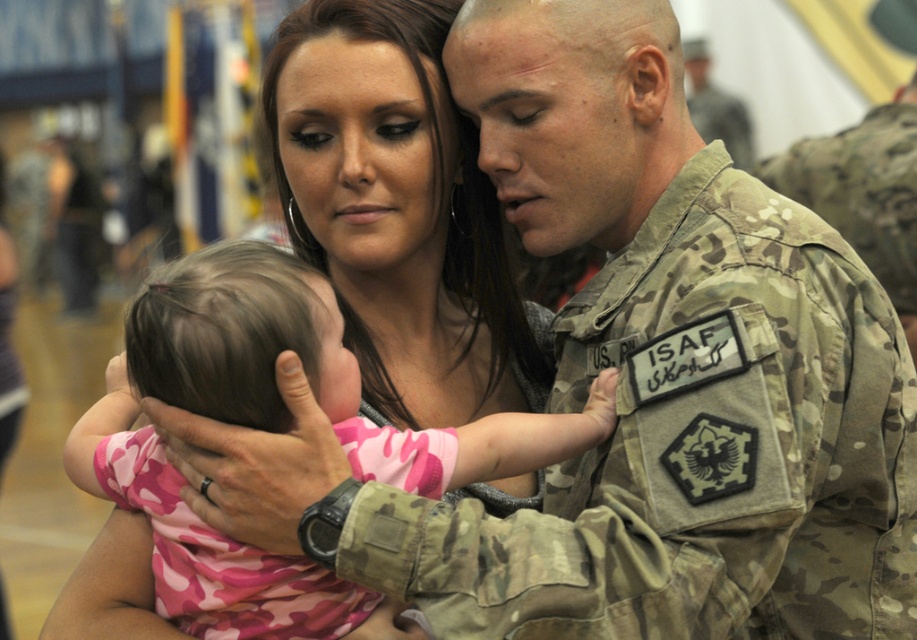
What is the spatial relationship between the camouflage fabric uniform at center and the other objects in the scene?

The camouflage fabric uniform at center is positioned at coordinates point [694,449].

You are a photographer trying to capture the best angle of the soldier holding the child. You have two markers placed at coordinates point [714,365] and point [591,397]. Which marker is closer to you?

Point [714,365] is closer to the viewer than point [591,397].